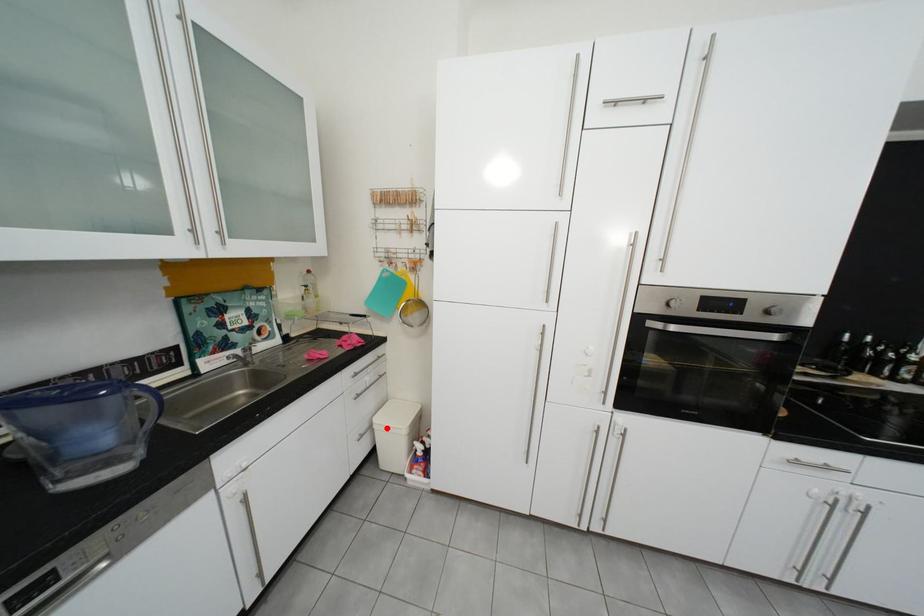
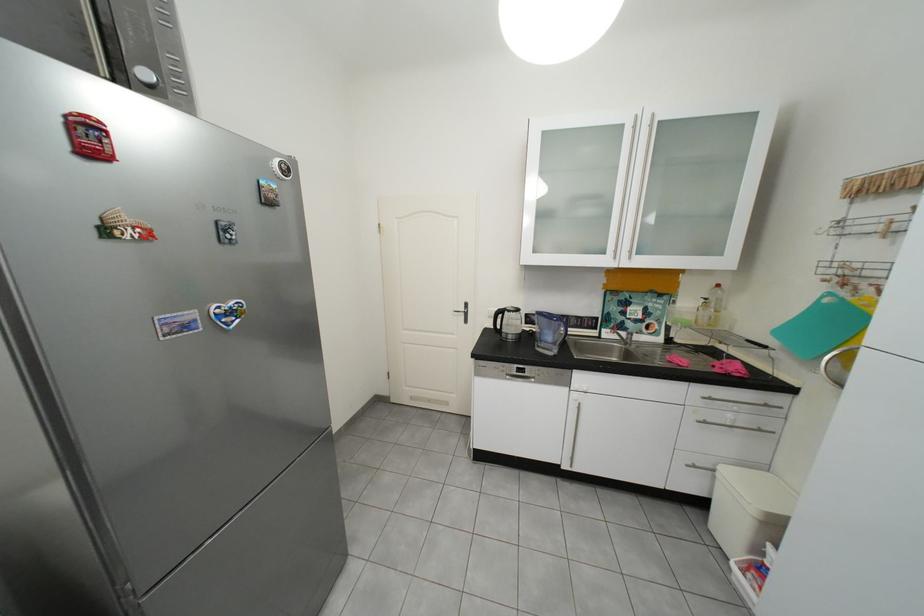
Question: I am providing you with two images of the same scene from different viewpoints. In image1, a red point is highlighted. Considering the same 3D point in image2, which of the following is correct?

Choices:
 (A) It is closer
 (B) It is farther

Answer: (A)